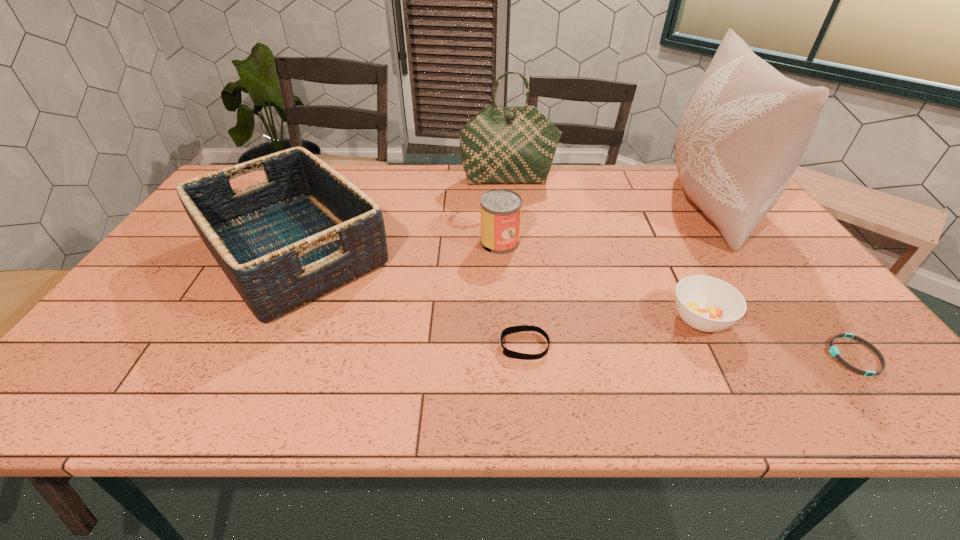
Locate an element on the screen. Image resolution: width=960 pixels, height=540 pixels. vacant space located 0.280m on the buckle of the right wristband is located at coordinates (704, 356).

Where is `blank area located on the buckle of the right wristband`? blank area located on the buckle of the right wristband is located at coordinates click(x=690, y=356).

Image resolution: width=960 pixels, height=540 pixels. Find the location of `vacant area situated 0.260m on the buckle of the right wristband`. vacant area situated 0.260m on the buckle of the right wristband is located at coordinates (712, 356).

The image size is (960, 540). Identify the location of cushion located at the far edge. (745, 128).

Locate an element on the screen. This screenshot has height=540, width=960. tote bag present at the far edge is located at coordinates (500, 145).

Where is `basket that is at the far edge`? The image size is (960, 540). basket that is at the far edge is located at coordinates (304, 231).

Where is `object at the near edge`? The width and height of the screenshot is (960, 540). object at the near edge is located at coordinates (833, 350).

Where is `object located at the left edge`? This screenshot has width=960, height=540. object located at the left edge is located at coordinates (304, 231).

Find the location of a particular element. The image size is (960, 540). cushion located at the right edge is located at coordinates (745, 128).

Where is `wristband at the right edge`? Image resolution: width=960 pixels, height=540 pixels. wristband at the right edge is located at coordinates [833, 350].